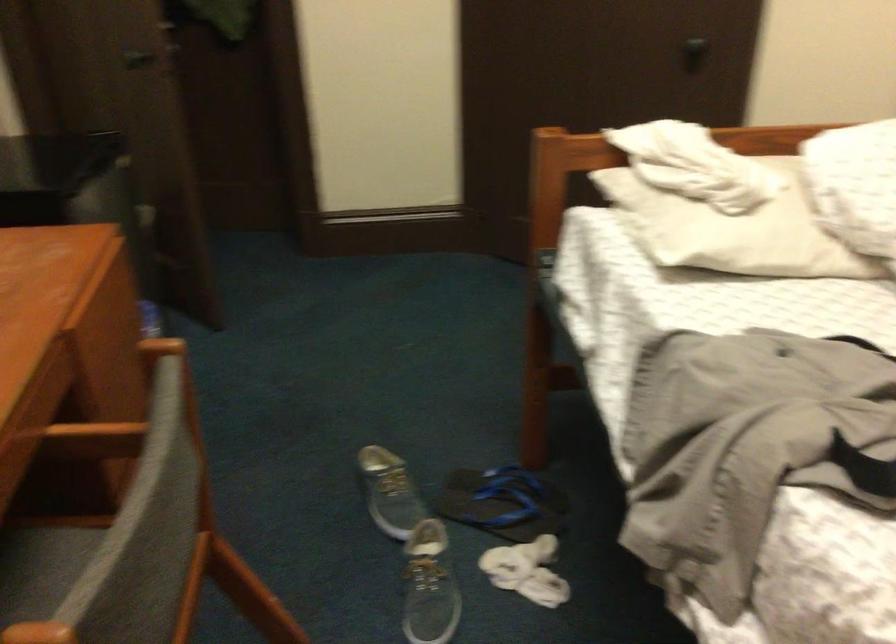
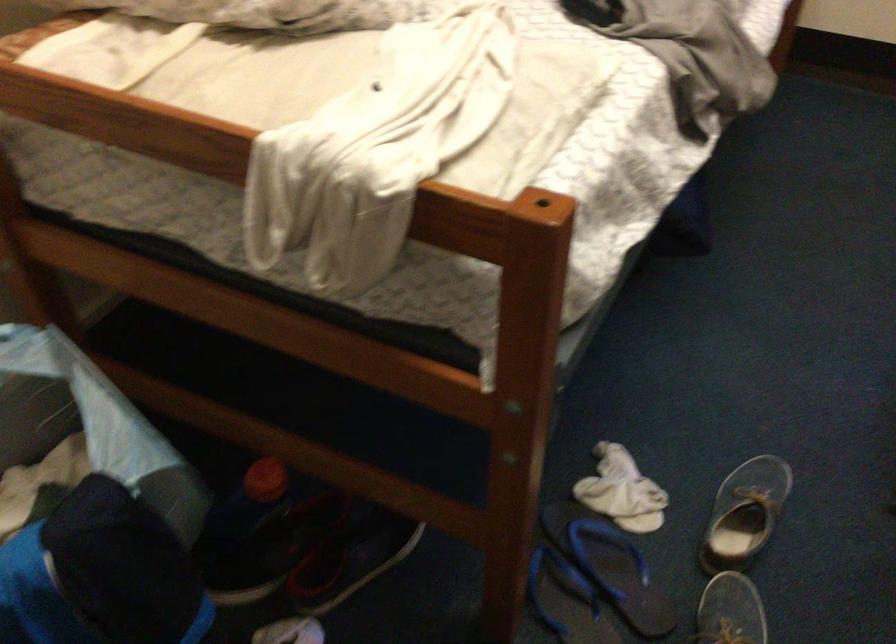
The point at (488, 522) is marked in the first image. Where is the corresponding point in the second image?

(609, 565)